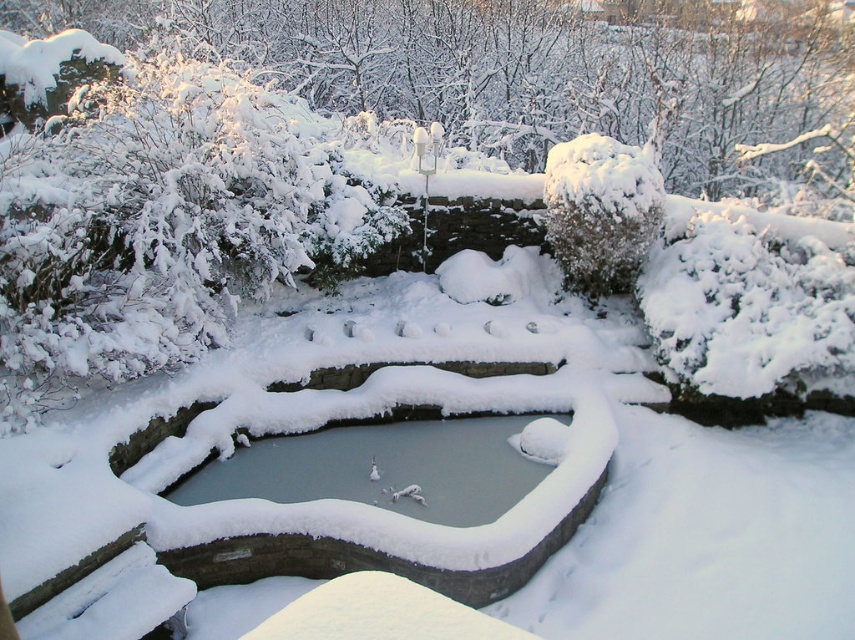
You are standing in the snow and want to walk from the white fluffy bush at upper left to the clear ice pond at center. Which direction should you move to reach the pond?

You should move to the right because the white fluffy bush at upper left is positioned on the left side of the clear ice pond at center.